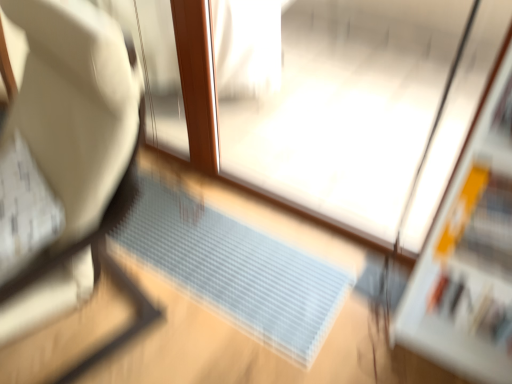
I want to click on unoccupied area in front of translucent plastic doormat at center, so click(x=185, y=338).